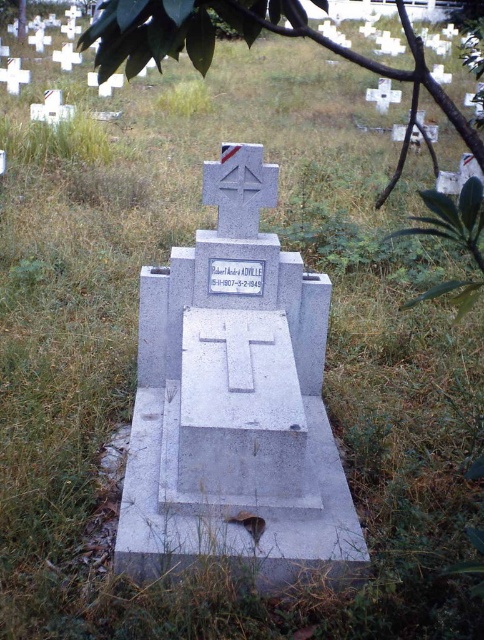
How distant is gray concrete cross at center from green leafy tree at upper center?

1.72 meters

Is gray concrete cross at center below green leafy tree at upper center?

Indeed, gray concrete cross at center is positioned under green leafy tree at upper center.

The height and width of the screenshot is (640, 484). What do you see at coordinates (233, 397) in the screenshot?
I see `gray concrete cross at center` at bounding box center [233, 397].

Where is `gray concrete cross at center`? Image resolution: width=484 pixels, height=640 pixels. gray concrete cross at center is located at coordinates (233, 397).